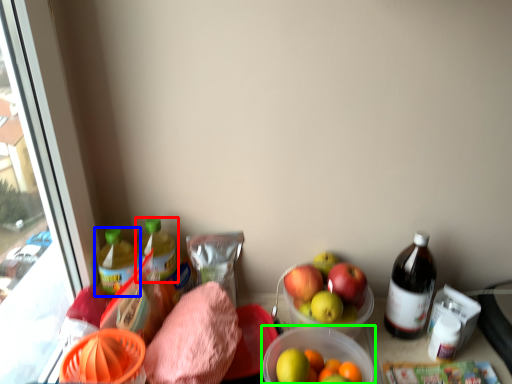
Question: Based on their relative distances, which object is nearer to bottle (highlighted by a red box)? Choose from bottle (highlighted by a blue box) and bowl (highlighted by a green box).

Choices:
 (A) bottle
 (B) bowl

Answer: (A)